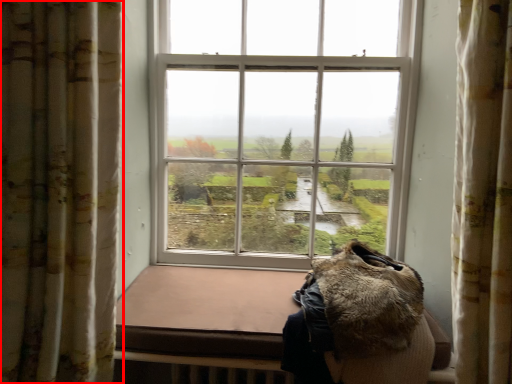
Question: From the image's perspective, what is the correct spatial relationship of curtain (annotated by the red box) in relation to animal?

Choices:
 (A) above
 (B) below

Answer: (A)